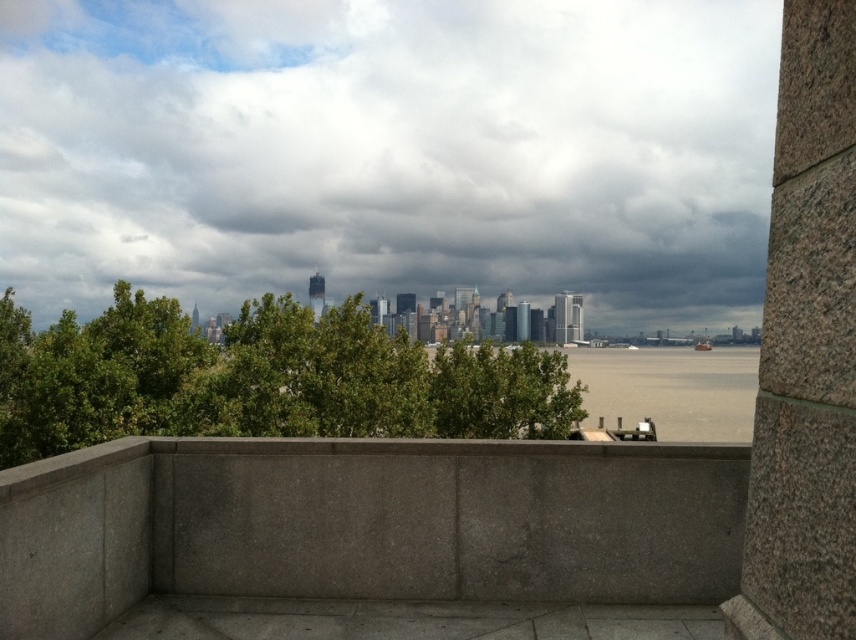
Question: Does cloudy sky at upper center appear on the right side of gray concrete ledge at center?

Choices:
 (A) yes
 (B) no

Answer: (B)

Question: Can you confirm if cloudy sky at upper center is positioned below gray concrete ledge at center?

Choices:
 (A) yes
 (B) no

Answer: (B)

Question: Which object appears closest to the camera in this image?

Choices:
 (A) gray concrete ledge at center
 (B) gray water at lower center
 (C) cloudy sky at upper center

Answer: (A)

Question: Which point is closer to the camera?

Choices:
 (A) (397, 109)
 (B) (502, 579)
 (C) (752, 376)

Answer: (B)

Question: Can you confirm if gray concrete ledge at center is positioned above gray water at lower center?

Choices:
 (A) no
 (B) yes

Answer: (B)

Question: Which object appears closest to the camera in this image?

Choices:
 (A) cloudy sky at upper center
 (B) gray water at lower center
 (C) gray concrete ledge at center

Answer: (C)